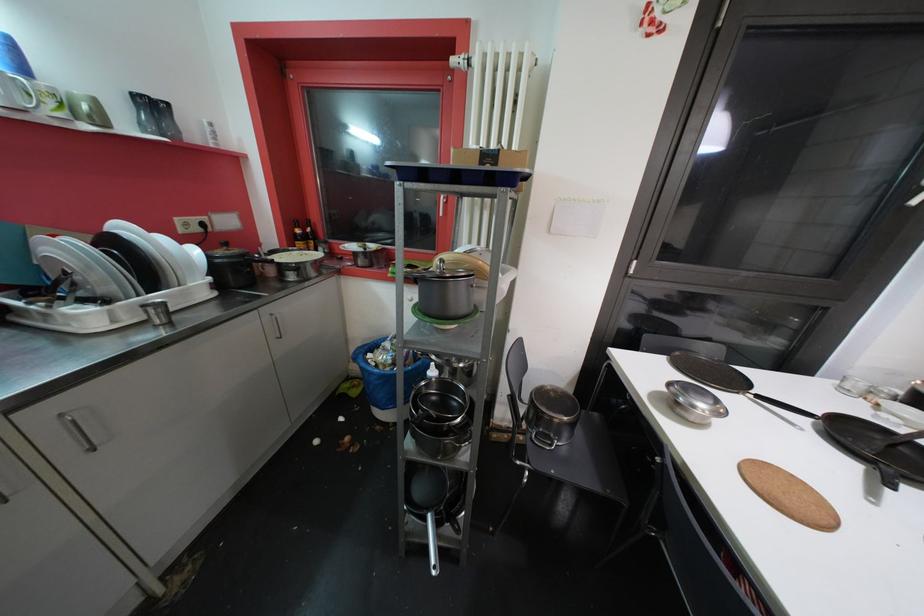
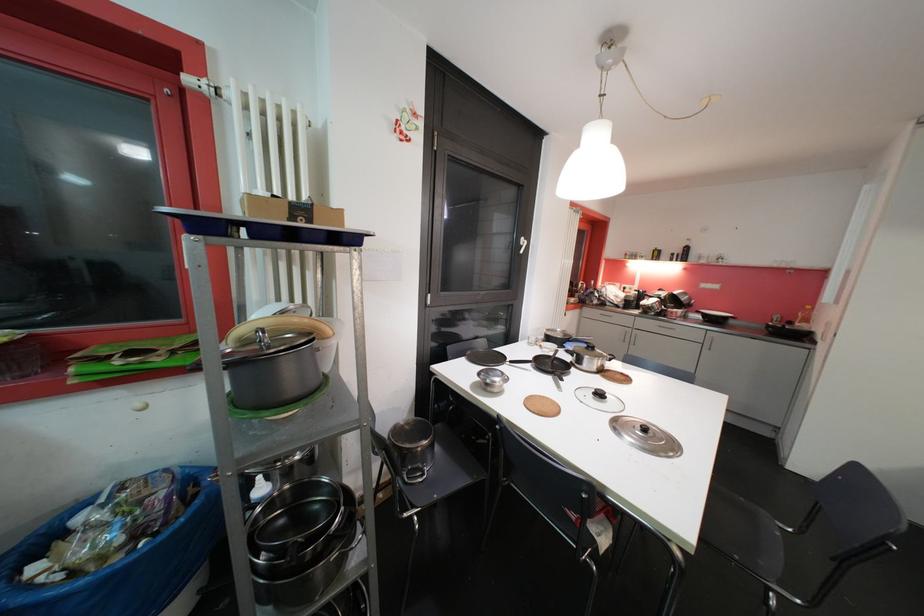
Where in the second image is the point corresponding to (763,399) from the first image?

(516, 363)